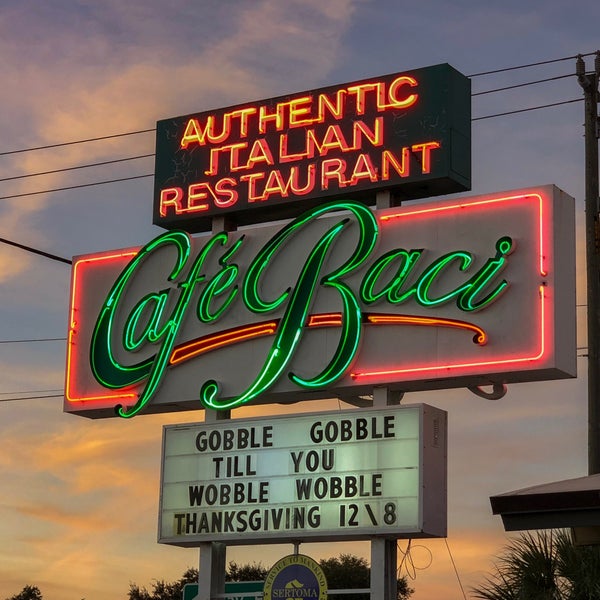
Locate an element on the screen. neon signs is located at coordinates click(288, 154), click(274, 279).